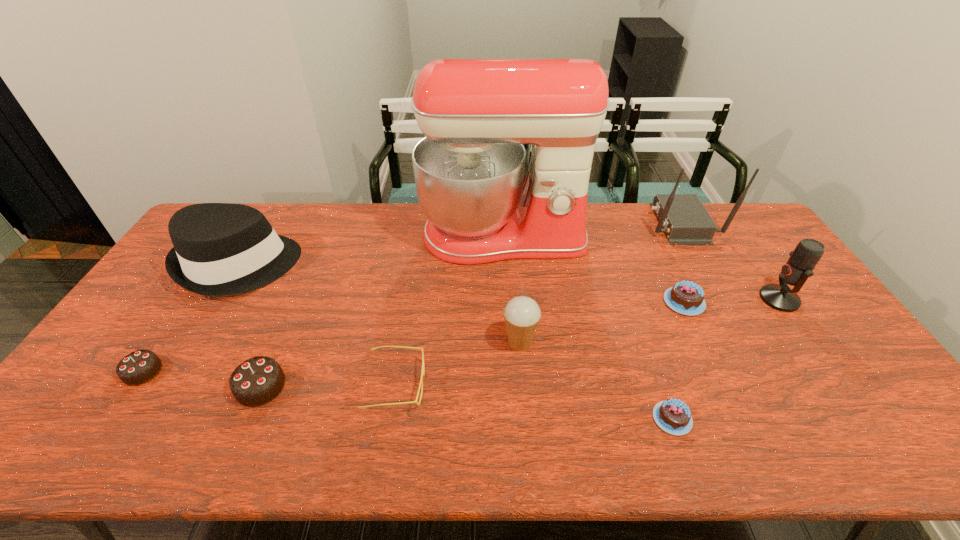
Locate an element on the screen. The width and height of the screenshot is (960, 540). router situated at the far edge is located at coordinates (684, 219).

Locate an element on the screen. This screenshot has width=960, height=540. fedora located at the far edge is located at coordinates (220, 249).

The height and width of the screenshot is (540, 960). Find the location of `object situated at the near edge`. object situated at the near edge is located at coordinates (673, 416).

Where is `fedora that is at the left edge`? The image size is (960, 540). fedora that is at the left edge is located at coordinates (220, 249).

At what (x,y) coordinates should I click in order to perform the action: click on chocolate cake positioned at the left edge. Please return your answer as a coordinate pair (x, y). The width and height of the screenshot is (960, 540). Looking at the image, I should click on (138, 367).

At what (x,y) coordinates should I click in order to perform the action: click on router positioned at the right edge. Please return your answer as a coordinate pair (x, y). The image size is (960, 540). Looking at the image, I should click on click(x=684, y=219).

At what (x,y) coordinates should I click in order to perform the action: click on microphone positioned at the right edge. Please return your answer as a coordinate pair (x, y). Looking at the image, I should click on [x=808, y=252].

Where is `object that is positioned at the far left corner`? The image size is (960, 540). object that is positioned at the far left corner is located at coordinates (220, 249).

Identify the location of object that is at the far right corner. (684, 219).

You are a GUI agent. You are given a task and a screenshot of the screen. Output one action in this format:
    pyautogui.click(x=<x>, y=<y>)
    Task: Click on the vacant space at the far edge of the desktop
    This screenshot has height=540, width=960.
    Given the screenshot: What is the action you would take?
    pyautogui.click(x=636, y=212)